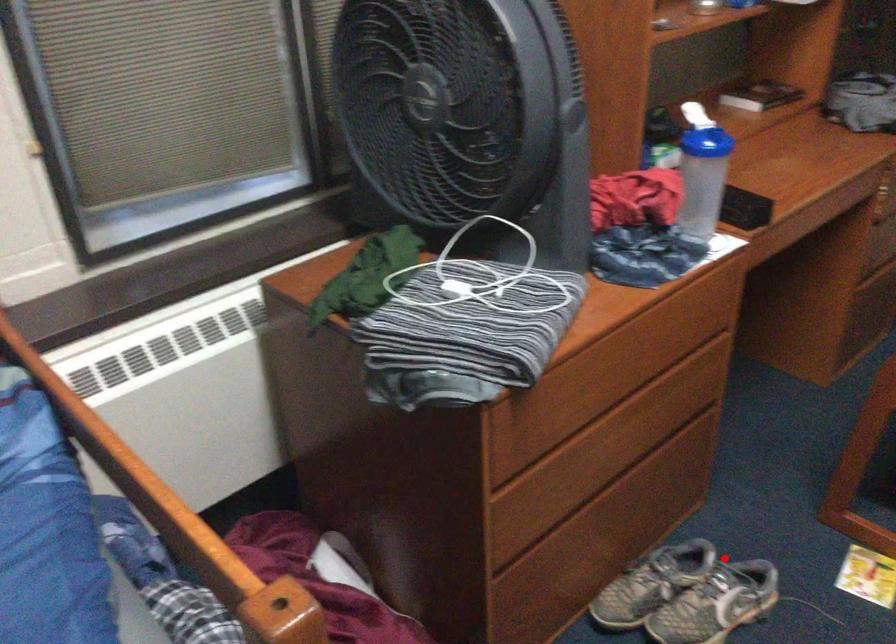
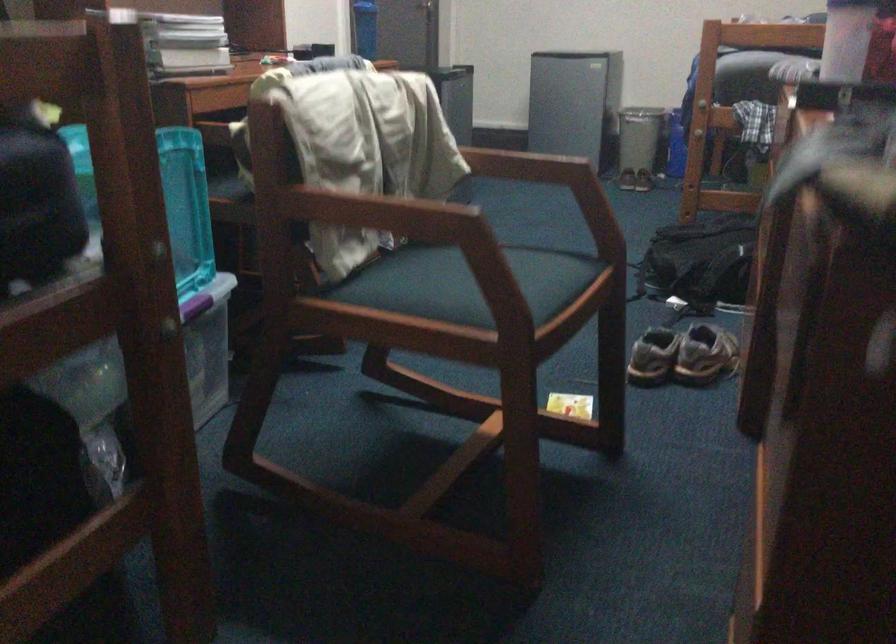
Where in the second image is the point corresponding to the highlighted location from the first image?

(682, 355)